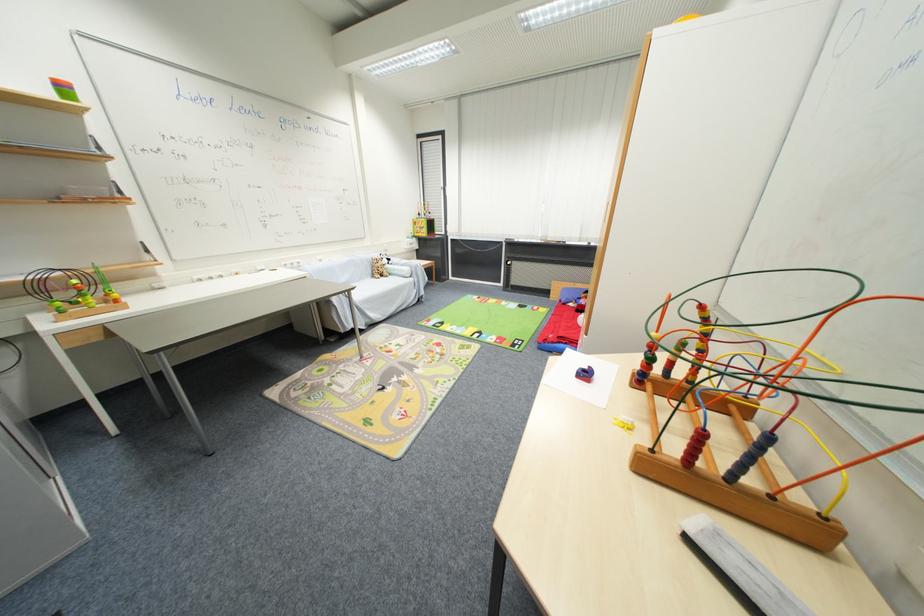
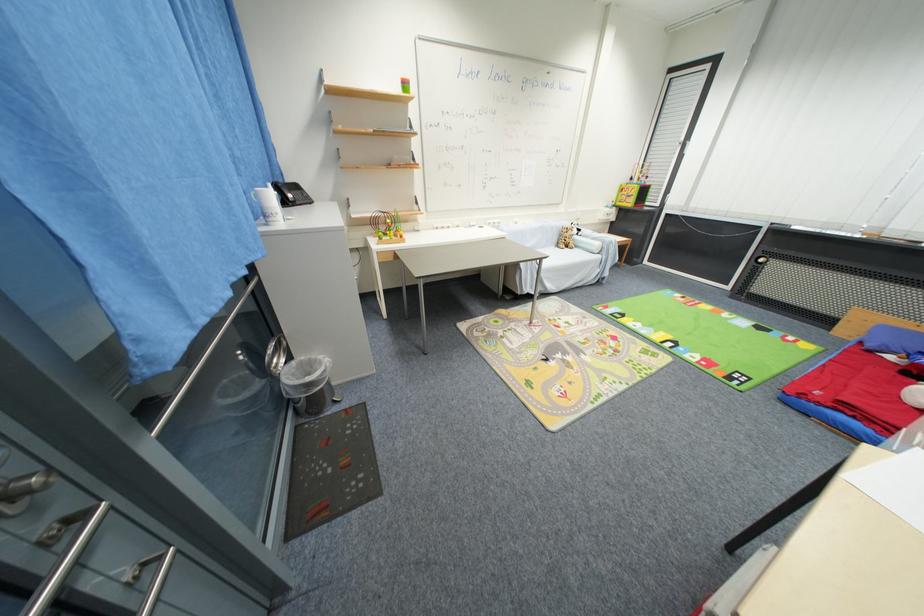
The point at (429, 236) is marked in the first image. Where is the corresponding point in the second image?

(635, 206)